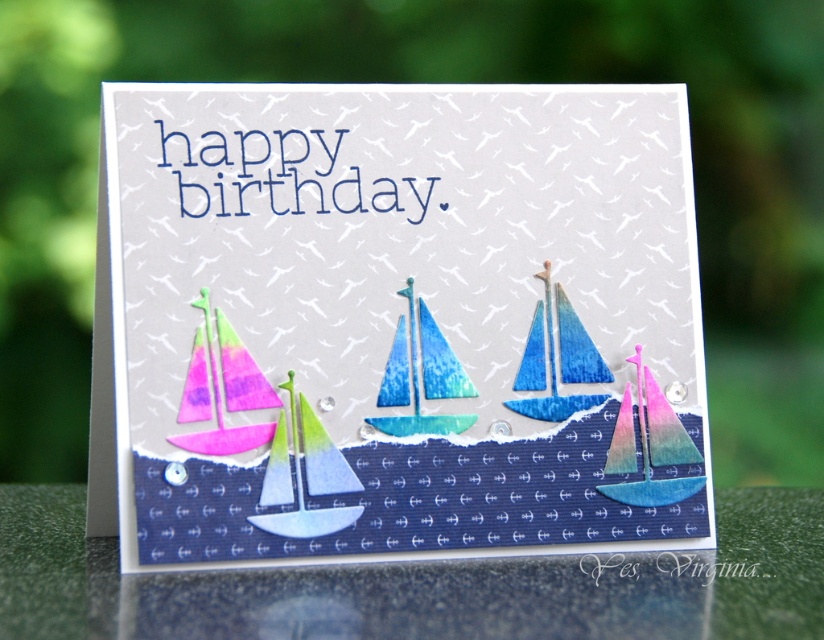
Question: Is watercolor sailboats at lower center to the left of navy blue paper boat at lower center from the viewer's perspective?

Choices:
 (A) no
 (B) yes

Answer: (B)

Question: Does translucent blue paper sailboat at center appear on the right side of pink holographic sailboat at center?

Choices:
 (A) yes
 (B) no

Answer: (B)

Question: Estimate the real-world distances between objects in this image. Which object is farther from the blue gradient paper sailboat at center?

Choices:
 (A) watercolor sailboat at left
 (B) navy blue paper boat at lower center
 (C) pink holographic sailboat at center
 (D) pink glossy sailboat at lower left

Answer: (A)

Question: Among these objects, which one is farthest from the camera?

Choices:
 (A) watercolor sailboats at lower center
 (B) watercolor sailboat at left
 (C) navy blue paper boat at lower center
 (D) blue gradient paper sailboat at center

Answer: (D)

Question: Among these points, which one is nearest to the camera?

Choices:
 (A) (673, 420)
 (B) (556, 296)
 (C) (303, 339)
 (D) (590, 596)

Answer: (D)

Question: Is watercolor sailboats at lower center to the right of translucent blue paper sailboat at center from the viewer's perspective?

Choices:
 (A) yes
 (B) no

Answer: (B)